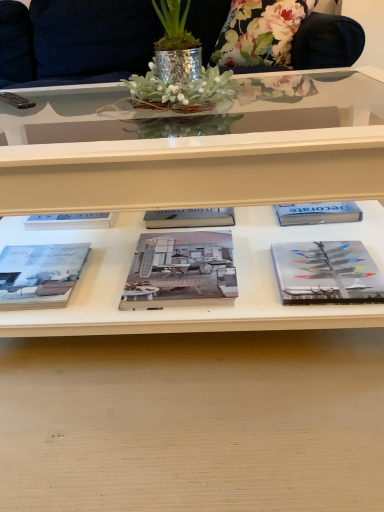
Image resolution: width=384 pixels, height=512 pixels. Identify the location of free space above gray matte book at right, acting as the 1th book starting from the right (from a real-world perspective). (324, 267).